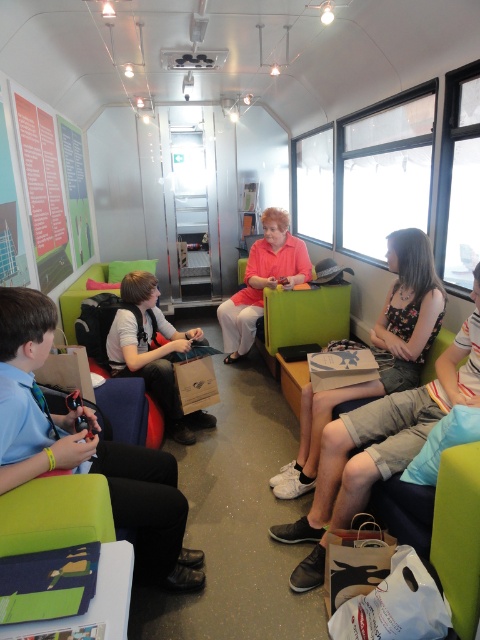
What do you see at coordinates (379, 348) in the screenshot?
I see `floral fabric dress at center` at bounding box center [379, 348].

Does floral fabric dress at center have a greater height compared to matte orange shirt at center?

Yes.

Find the location of a particular element. The height and width of the screenshot is (640, 480). floral fabric dress at center is located at coordinates (379, 348).

Does light blue shirt at left appear on the left side of matte brown paper bag at center?

Incorrect, light blue shirt at left is not on the left side of matte brown paper bag at center.

Who is more forward, (33, 428) or (168, 433)?

Point (33, 428) is more forward.

Where is `light blue shirt at left`? Image resolution: width=480 pixels, height=640 pixels. light blue shirt at left is located at coordinates (86, 449).

Which of these two, light blue shirt at left or floral fabric dress at center, stands taller?

floral fabric dress at center

In the scene shown: Who is lower down, light blue shirt at left or floral fabric dress at center?

light blue shirt at left

At what (x,y) coordinates should I click in order to perform the action: click on light blue shirt at left. Please return your answer as a coordinate pair (x, y). Looking at the image, I should click on (86, 449).